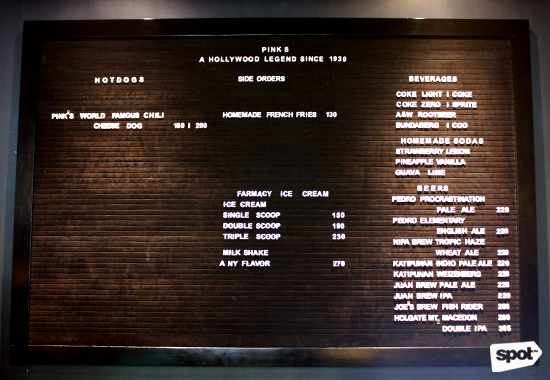
You are a GUI agent. You are given a task and a screenshot of the screen. Output one action in this format:
    pyautogui.click(x=<x>, y=<y>)
    Task: Click on the back lighting
    This screenshot has height=380, width=550.
    Given the screenshot: What is the action you would take?
    pyautogui.click(x=424, y=13), pyautogui.click(x=147, y=15)